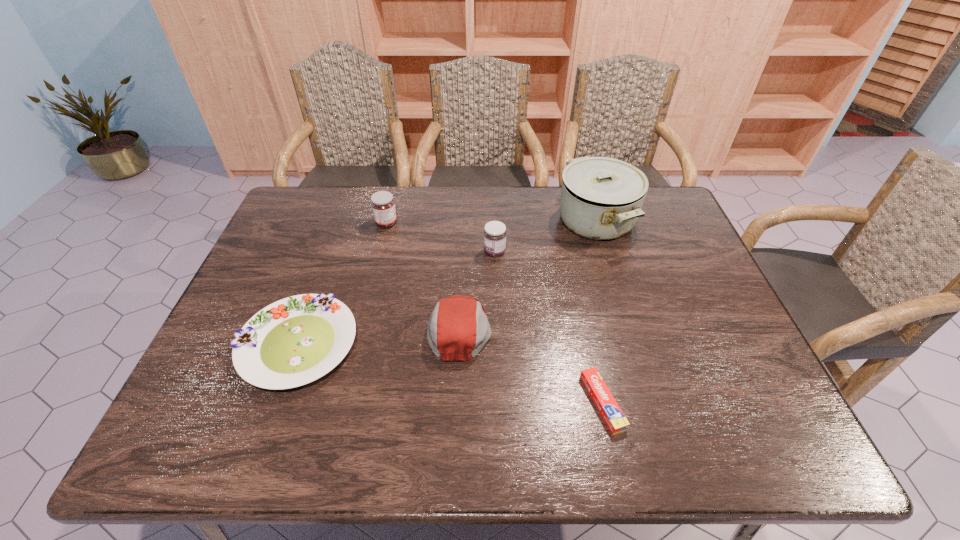
I want to click on the tallest object, so click(601, 198).

Where is `the left jam`? The width and height of the screenshot is (960, 540). the left jam is located at coordinates (383, 205).

Where is `cap`? cap is located at coordinates (458, 329).

Image resolution: width=960 pixels, height=540 pixels. Find the location of `the nearer jam`. the nearer jam is located at coordinates (495, 233).

Where is `the second shortest object`? the second shortest object is located at coordinates [x=294, y=341].

Where is `toothpaste`? The width and height of the screenshot is (960, 540). toothpaste is located at coordinates (613, 416).

The height and width of the screenshot is (540, 960). What are the coordinates of `free space located on the left of the saucepan` in the screenshot? It's located at (497, 221).

You are a GUI agent. You are given a task and a screenshot of the screen. Output one action in this format:
    pyautogui.click(x=<x>, y=<y>)
    Task: Click on the free space located 0.220m on the front of the left jam
    Image resolution: width=960 pixels, height=540 pixels.
    Given the screenshot: What is the action you would take?
    pyautogui.click(x=372, y=280)

The image size is (960, 540). I want to click on vacant position located 0.300m on the front-facing side of the cap, so click(611, 329).

Identify the location of free region located 0.300m on the front label of the nearer jam. The height and width of the screenshot is (540, 960). (383, 252).